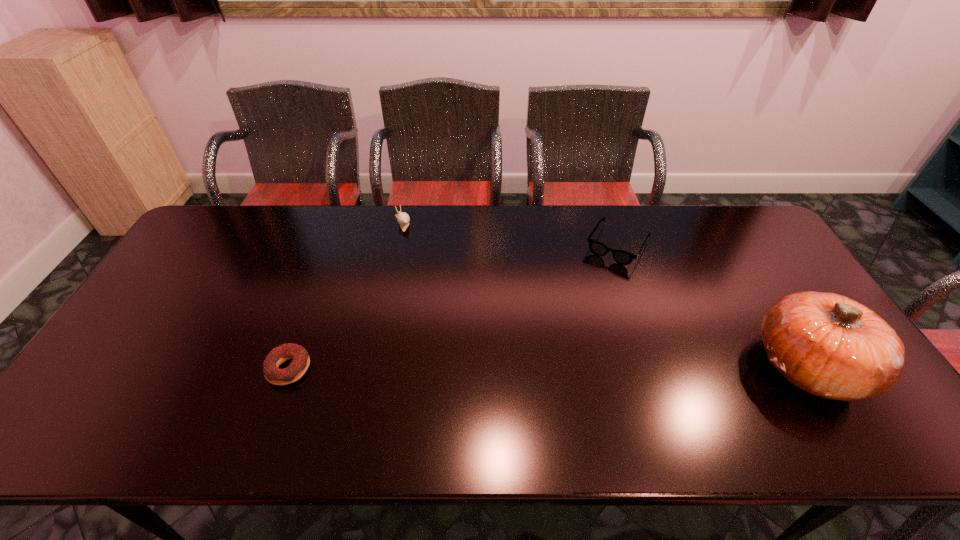
Where is `doughnut`? doughnut is located at coordinates (300, 358).

I want to click on the rightmost object, so click(831, 346).

Find the location of a particular element. This screenshot has width=960, height=540. pumpkin is located at coordinates (831, 346).

Where is `escargot`? Image resolution: width=960 pixels, height=540 pixels. escargot is located at coordinates (403, 219).

Where is `the third object from left to right`? The image size is (960, 540). the third object from left to right is located at coordinates (622, 257).

At what (x,y) coordinates should I click in order to perform the action: click on free space located 0.350m on the back of the doughnut. Please return your answer as a coordinate pair (x, y). Image resolution: width=960 pixels, height=540 pixels. Looking at the image, I should click on (327, 260).

You are a GUI agent. You are given a task and a screenshot of the screen. Output one action in this format:
    pyautogui.click(x=<x>, y=<y>)
    Task: Click on the free space located on the back of the tallest object
    
    Given the screenshot: What is the action you would take?
    pyautogui.click(x=766, y=298)

Where is `vacant region located 0.090m on the shell of the second object from left to right`? vacant region located 0.090m on the shell of the second object from left to right is located at coordinates (412, 247).

Identify the location of free region located on the shell of the second object from left to right. (418, 259).

Find the location of a particular element. vacant region located 0.270m on the shell of the second object from left to right is located at coordinates (429, 284).